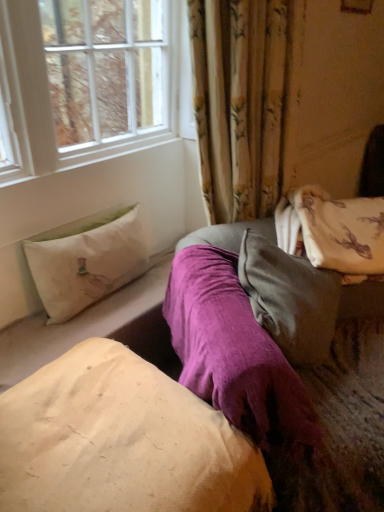
The width and height of the screenshot is (384, 512). Identify the location of free location above beige cotton pillow at center, placed as the 1th pillow when sorted from bottom to top (from a real-world perspective). (117, 422).